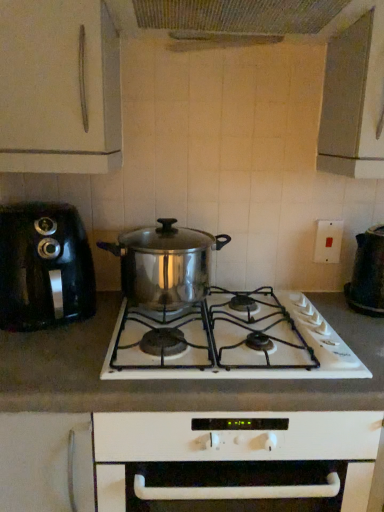
Image resolution: width=384 pixels, height=512 pixels. Describe the element at coordinates (175, 380) in the screenshot. I see `white matte countertop at center` at that location.

Locate an element on the screen. This screenshot has width=384, height=512. black plastic toaster at left, acting as the 1th kitchen appliance starting from the left is located at coordinates (44, 267).

Measure the distance between black plastic toaster at left, which ranks as the 2th kitchen appliance in right-to-left order, and camera.

black plastic toaster at left, which ranks as the 2th kitchen appliance in right-to-left order, is 1.05 meters from camera.

In order to face black plastic kettle at right, which is the 2th kitchen appliance in left-to-right order, should I rotate leftwards or rightwards?

Rotate right and turn 23.665 degrees.

Where is `black plastic kettle at right, the 1th kitchen appliance viewed from the right`? black plastic kettle at right, the 1th kitchen appliance viewed from the right is located at coordinates (368, 273).

What are the coordinates of `stainless steel pot at center` in the screenshot? It's located at (165, 263).

Considering the relative sizes of black plastic toaster at left, acting as the 1th kitchen appliance starting from the left, and white plastic switch at upper right in the image provided, is black plastic toaster at left, acting as the 1th kitchen appliance starting from the left, smaller than white plastic switch at upper right?

No, black plastic toaster at left, acting as the 1th kitchen appliance starting from the left, is not smaller than white plastic switch at upper right.

Would you consider black plastic toaster at left, acting as the 1th kitchen appliance starting from the left, to be distant from white plastic switch at upper right?

That's not correct — black plastic toaster at left, acting as the 1th kitchen appliance starting from the left, is a little close to white plastic switch at upper right.

From a real-world perspective, which is physically above, black plastic toaster at left, acting as the 1th kitchen appliance starting from the left, or white plastic switch at upper right?

white plastic switch at upper right, from a real-world perspective.

From the image's perspective, is black plastic toaster at left, which ranks as the 2th kitchen appliance in right-to-left order, located above or below white plastic switch at upper right?

From the image's perspective, black plastic toaster at left, which ranks as the 2th kitchen appliance in right-to-left order, appears below white plastic switch at upper right.

Is point (152, 257) less distant than point (292, 11)?

That is False.

Is stainless steel pot at center aimed at metallic mesh at upper center?

No, stainless steel pot at center does not turn towards metallic mesh at upper center.

From the image's perspective, which is above, stainless steel pot at center or metallic mesh at upper center?

metallic mesh at upper center appears higher in the image.

Is black plastic kettle at right, which is the 2th kitchen appliance in left-to-right order, aimed at metallic mesh at upper center?

No.

Is black plastic kettle at right, the 1th kitchen appliance viewed from the right, bigger or smaller than metallic mesh at upper center?

Considering their sizes, black plastic kettle at right, the 1th kitchen appliance viewed from the right, takes up less space than metallic mesh at upper center.

In terms of width, does black plastic kettle at right, which is the 2th kitchen appliance in left-to-right order, look wider or thinner when compared to metallic mesh at upper center?

Considering their sizes, black plastic kettle at right, which is the 2th kitchen appliance in left-to-right order, looks slimmer than metallic mesh at upper center.

Would you say black plastic kettle at right, the 1th kitchen appliance viewed from the right, contains metallic mesh at upper center?

No, metallic mesh at upper center is located outside of black plastic kettle at right, the 1th kitchen appliance viewed from the right.

Between stainless steel pot at center and white matte countertop at center, which one has smaller size?

With smaller size is stainless steel pot at center.

Looking at this image, is stainless steel pot at center inside or outside of white matte countertop at center?

stainless steel pot at center is spatially situated outside white matte countertop at center.

Considering the relative sizes of stainless steel pot at center and white matte countertop at center in the image provided, is stainless steel pot at center shorter than white matte countertop at center?

Correct, stainless steel pot at center is not as tall as white matte countertop at center.

Which of these two, metallic mesh at upper center or white matte countertop at center, stands shorter?

metallic mesh at upper center.

Is metallic mesh at upper center spatially inside white matte countertop at center, or outside of it?

metallic mesh at upper center exists outside the volume of white matte countertop at center.

Is metallic mesh at upper center in contact with white matte countertop at center?

No, metallic mesh at upper center is not next to white matte countertop at center.

In the scene shown: Considering the sizes of metallic mesh at upper center and white matte countertop at center in the image, is metallic mesh at upper center bigger or smaller than white matte countertop at center?

metallic mesh at upper center is smaller than white matte countertop at center.

Considering the positions of point (83, 285) and point (357, 266), is point (83, 285) closer or farther from the camera than point (357, 266)?

Clearly, point (83, 285) is closer to the camera than point (357, 266).

Where is `kitchen appliance on the left side of black plastic kettle at right, the 1th kitchen appliance viewed from the right`? kitchen appliance on the left side of black plastic kettle at right, the 1th kitchen appliance viewed from the right is located at coordinates (44, 267).

Considering the sizes of black plastic toaster at left, acting as the 1th kitchen appliance starting from the left, and black plastic kettle at right, the 1th kitchen appliance viewed from the right, in the image, is black plastic toaster at left, acting as the 1th kitchen appliance starting from the left, taller or shorter than black plastic kettle at right, the 1th kitchen appliance viewed from the right,?

Clearly, black plastic toaster at left, acting as the 1th kitchen appliance starting from the left, is taller compared to black plastic kettle at right, the 1th kitchen appliance viewed from the right.

Is black plastic toaster at left, which ranks as the 2th kitchen appliance in right-to-left order, placed right next to black plastic kettle at right, the 1th kitchen appliance viewed from the right?

No, black plastic toaster at left, which ranks as the 2th kitchen appliance in right-to-left order, is not with black plastic kettle at right, the 1th kitchen appliance viewed from the right.

From a real-world perspective, which is physically below, stainless steel pot at center or black plastic kettle at right, the 1th kitchen appliance viewed from the right?

In real-world perspective, stainless steel pot at center is lower.

From a real-world perspective, starting from the stainless steel pot at center, which kitchen appliance is the 1st one vertically above it? Please provide its 2D coordinates.

[(368, 273)]

Is stainless steel pot at center far from black plastic kettle at right, which is the 2th kitchen appliance in left-to-right order?

No, stainless steel pot at center is not far from black plastic kettle at right, which is the 2th kitchen appliance in left-to-right order.

Where is `kitchen appliance that is the 1st one when counting downward from the white plastic switch at upper right (from the image's perspective)`? kitchen appliance that is the 1st one when counting downward from the white plastic switch at upper right (from the image's perspective) is located at coordinates (44, 267).

Identify the location of exhaust hood above the stainless steel pot at center (from the image's perspective). (x=236, y=17).

Which object lies nearer to the anchor point white plastic switch at upper right, stainless steel pot at center or black plastic toaster at left, which ranks as the 2th kitchen appliance in right-to-left order?

stainless steel pot at center is closer to white plastic switch at upper right.

From the image, which object appears to be farther from black plastic toaster at left, which ranks as the 2th kitchen appliance in right-to-left order, white plastic switch at upper right or metallic mesh at upper center?

white plastic switch at upper right.

From the image, which object appears to be farther from metallic mesh at upper center, white plastic switch at upper right or stainless steel pot at center?

stainless steel pot at center.

Which object lies nearer to the anchor point white matte countertop at center, metallic mesh at upper center or black plastic kettle at right, the 1th kitchen appliance viewed from the right?

The object closer to white matte countertop at center is black plastic kettle at right, the 1th kitchen appliance viewed from the right.

When comparing their distances from black plastic kettle at right, the 1th kitchen appliance viewed from the right, does stainless steel pot at center or black plastic toaster at left, acting as the 1th kitchen appliance starting from the left, seem further?

black plastic toaster at left, acting as the 1th kitchen appliance starting from the left, is further to black plastic kettle at right, the 1th kitchen appliance viewed from the right.

Which object lies further to the anchor point metallic mesh at upper center, stainless steel pot at center or white matte countertop at center?

white matte countertop at center lies further to metallic mesh at upper center than the other object.

Which object lies further to the anchor point black plastic kettle at right, which is the 2th kitchen appliance in left-to-right order, stainless steel pot at center or metallic mesh at upper center?

metallic mesh at upper center is positioned further to the anchor black plastic kettle at right, which is the 2th kitchen appliance in left-to-right order.

From the image, which object appears to be farther from stainless steel pot at center, white plastic switch at upper right or white matte countertop at center?

Among the two, white plastic switch at upper right is located further to stainless steel pot at center.

The width and height of the screenshot is (384, 512). Identify the location of slow cooker between metallic mesh at upper center and black plastic toaster at left, which ranks as the 2th kitchen appliance in right-to-left order, in the vertical direction. pyautogui.click(x=165, y=263).

You are a GUI agent. You are given a task and a screenshot of the screen. Output one action in this format:
    pyautogui.click(x=<x>, y=<y>)
    Task: Click on the gas stove between stainless steel pot at center and black plastic kettle at right, which is the 2th kitchen appliance in left-to-right order, from left to right
    
    Given the screenshot: What is the action you would take?
    pyautogui.click(x=233, y=342)

The width and height of the screenshot is (384, 512). I want to click on countertop between black plastic toaster at left, which ranks as the 2th kitchen appliance in right-to-left order, and white plastic switch at upper right, in the horizontal direction, so click(x=175, y=380).

Image resolution: width=384 pixels, height=512 pixels. What are the coordinates of `exhaust hood between black plastic toaster at left, acting as the 1th kitchen appliance starting from the left, and white plastic switch at upper right, in the horizontal direction` in the screenshot? It's located at (236, 17).